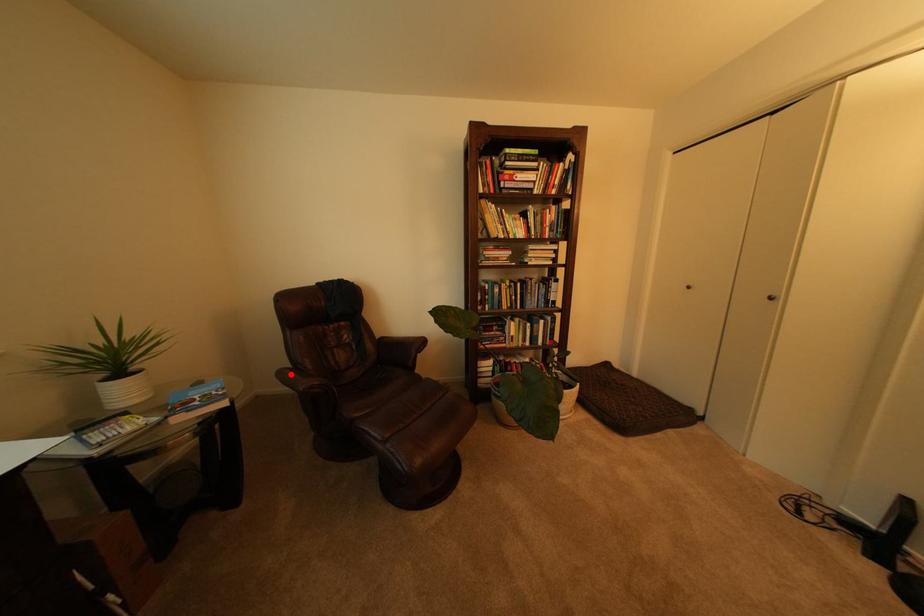
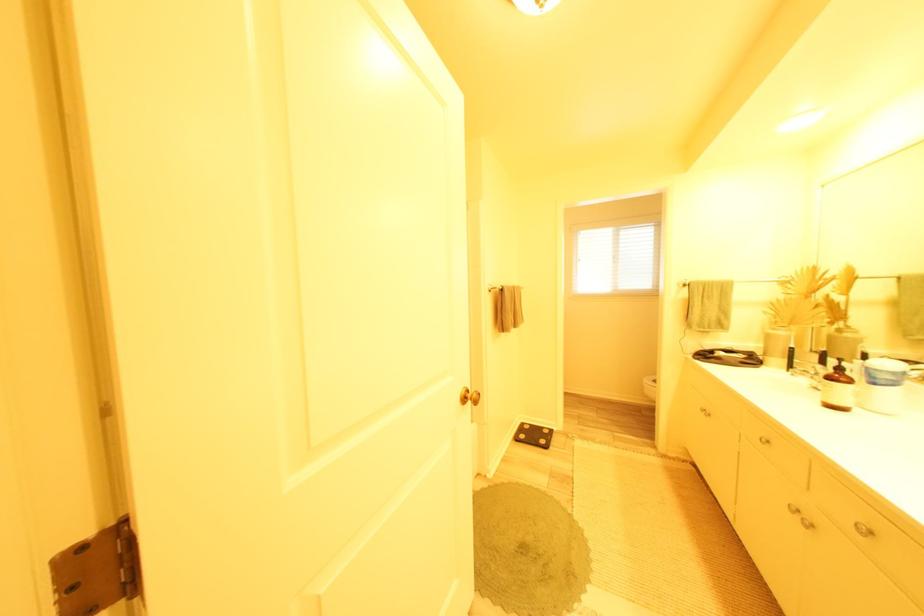
Question: I am providing you with two images of the same scene from different viewpoints. A red point is marked on the first image. At the location where the point appears in image 1, is it still visible in image 2?

Choices:
 (A) Yes
 (B) No

Answer: (B)